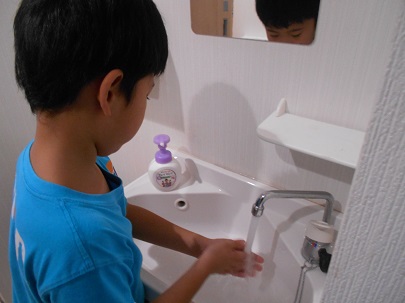
Where is `wall`? wall is located at coordinates (223, 75).